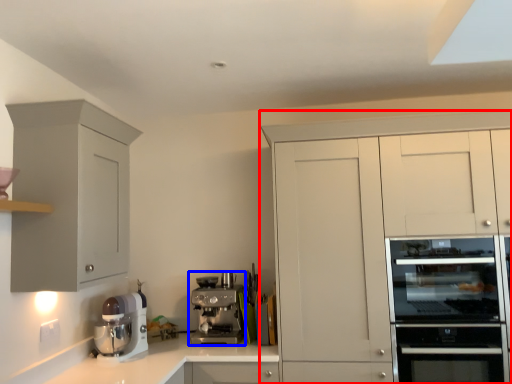
Question: Which point is further to the camera, cabinetry (highlighted by a red box) or kitchen appliance (highlighted by a blue box)?

Choices:
 (A) cabinetry
 (B) kitchen appliance

Answer: (B)